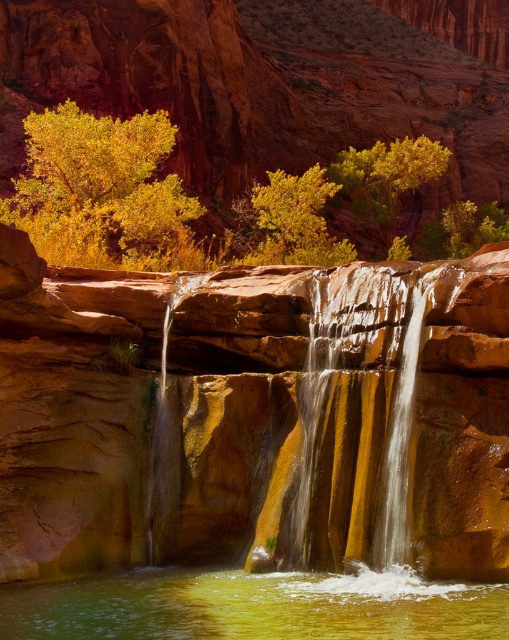
Question: Based on their relative distances, which object is farther from the smooth golden rock at center?

Choices:
 (A) smooth brown water at center
 (B) golden textured bush at upper left

Answer: (B)

Question: Which of the following is the farthest from the observer?

Choices:
 (A) yellow leafy tree at center
 (B) smooth golden rock at center
 (C) smooth brown water at center
 (D) green translucent water at lower center

Answer: (A)

Question: Can you confirm if golden textured bush at upper left is smaller than smooth brown water at center?

Choices:
 (A) no
 (B) yes

Answer: (A)

Question: Is green translucent water at lower center to the right of golden textured bush at upper left from the viewer's perspective?

Choices:
 (A) yes
 (B) no

Answer: (A)

Question: Which object is closer to the camera taking this photo?

Choices:
 (A) smooth golden rock at center
 (B) smooth brown water at center

Answer: (B)

Question: Does green translucent water at lower center come in front of golden textured bush at upper left?

Choices:
 (A) yes
 (B) no

Answer: (A)